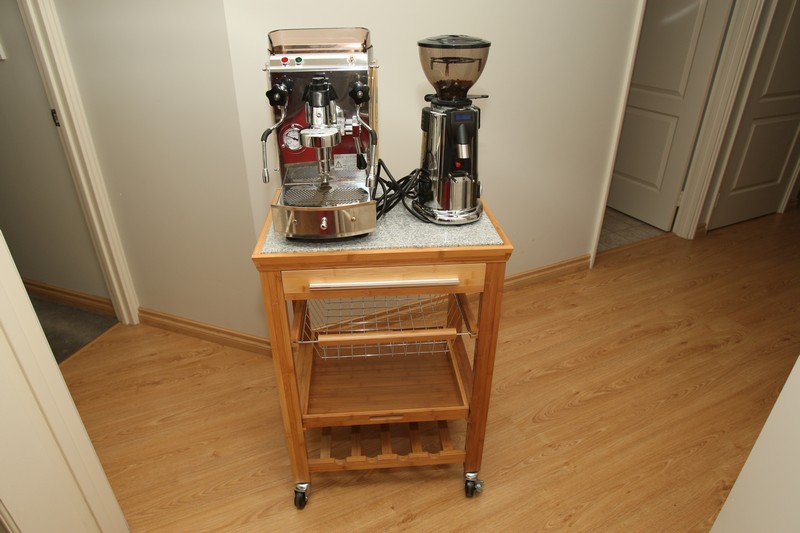
Where is `coffee machine`? This screenshot has width=800, height=533. coffee machine is located at coordinates (446, 161).